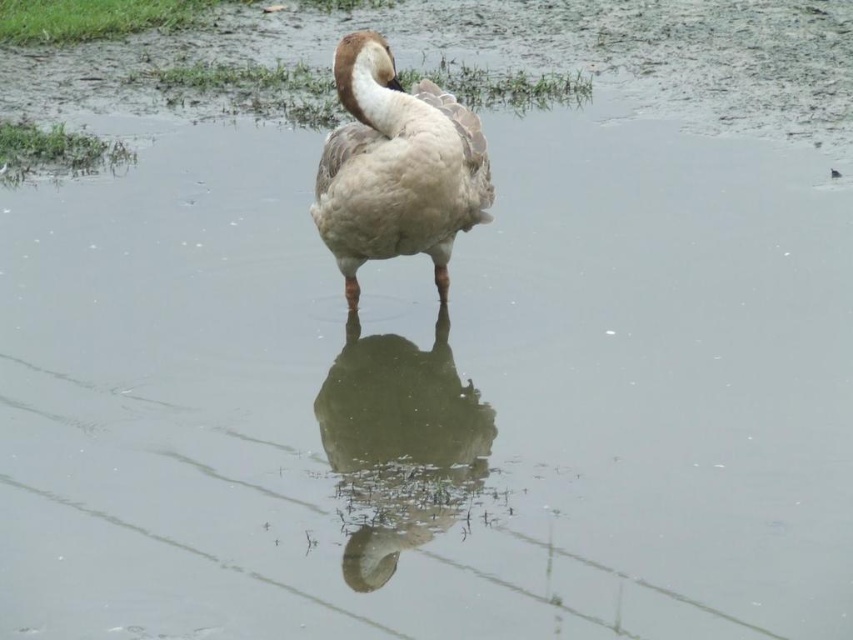
You are observing a goose in a pond. You notice two ducks in the scene described as the brown matte duck at center and the brown feathered duck at center. Which duck is positioned lower in the image?

The brown matte duck at center is located below the brown feathered duck at center, so it is positioned lower in the image.

You are a birdwatcher standing on the edge of the pond. You see a goose and a brown matte duck at center in the water. Which one is closer to you?

The brown matte duck at center is closer to you because they are 8.99 feet apart.

You are observing a goose in shallow water and notice a brown matte duck at center. Based on their positions, which object is closer to the center of the image?

The brown matte duck at center is exactly at the center of the image, so it is the closest to the center.